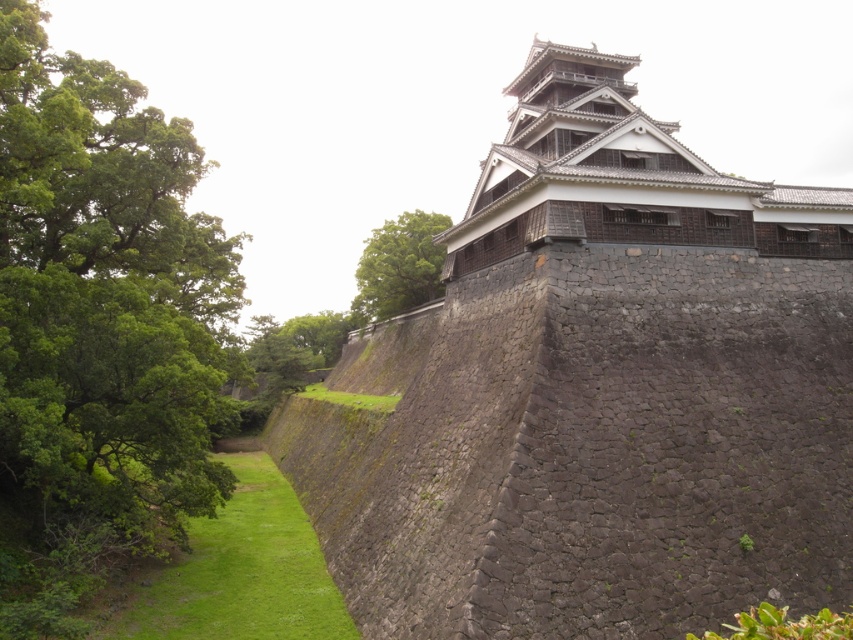
You are a visitor at Kumamoto Castle and want to take a photo that includes both the green leafy tree at left and the dark gray stone tower at upper center. Which object should you position closer to the edge of the frame to ensure both fit in the shot?

Since the green leafy tree at left is narrower than the dark gray stone tower at upper center, you should position the wider dark gray stone tower at upper center closer to the edge of the frame to ensure both fit in the shot.

You are a visitor at Kumamoto Castle and notice the dark gray stone tower at upper center and the green leafy tree at upper center. Which object is positioned higher in the image?

The green leafy tree at upper center is positioned higher than the dark gray stone tower at upper center.

You are an architect analyzing the structure of Kumamoto Castle. You notice the dark gray stone tower at upper center and the green leafy tree at upper center in the image. Which object occupies a larger horizontal space in the scene?

The dark gray stone tower at upper center has a greater width than the green leafy tree at upper center, so it occupies a larger horizontal space in the scene.